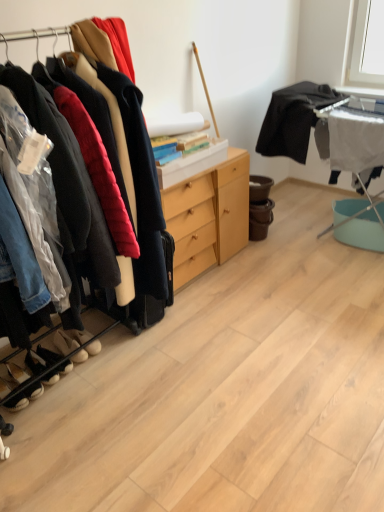
Question: Is black suede shoes at lower left, which appears as the second footwear when viewed from the front, shorter than white fabric ironing board at right?

Choices:
 (A) no
 (B) yes

Answer: (B)

Question: From a real-world perspective, is black suede shoes at lower left, which appears as the second footwear when viewed from the front, on top of white fabric ironing board at right?

Choices:
 (A) yes
 (B) no

Answer: (B)

Question: Considering the relative sizes of black suede shoes at lower left, which appears as the fourth footwear when viewed from the back, and white fabric ironing board at right in the image provided, is black suede shoes at lower left, which appears as the fourth footwear when viewed from the back, wider than white fabric ironing board at right?

Choices:
 (A) no
 (B) yes

Answer: (B)

Question: Can you confirm if black suede shoes at lower left, which appears as the second footwear when viewed from the front, is bigger than white fabric ironing board at right?

Choices:
 (A) yes
 (B) no

Answer: (B)

Question: From the image's perspective, is black suede shoes at lower left, which appears as the second footwear when viewed from the front, above white fabric ironing board at right?

Choices:
 (A) yes
 (B) no

Answer: (B)

Question: Based on their sizes in the image, would you say black matte shirt at upper right is bigger or smaller than black suede shoes at lower left, which appears as the fourth footwear when viewed from the back?

Choices:
 (A) big
 (B) small

Answer: (A)

Question: From a real-world perspective, relative to black suede shoes at lower left, which appears as the second footwear when viewed from the front, is black matte shirt at upper right vertically above or below?

Choices:
 (A) below
 (B) above

Answer: (B)

Question: From their relative heights in the image, would you say black matte shirt at upper right is taller or shorter than black suede shoes at lower left, which appears as the fourth footwear when viewed from the back?

Choices:
 (A) short
 (B) tall

Answer: (B)

Question: From the image's perspective, is black matte shirt at upper right located above or below black suede shoes at lower left, which appears as the second footwear when viewed from the front?

Choices:
 (A) above
 (B) below

Answer: (A)

Question: In the image, is white suede shoes at lower left, the fifth footwear in the back-to-front sequence, positioned in front of or behind black suede shoes at lower left, which appears as the fourth footwear when viewed from the back?

Choices:
 (A) behind
 (B) front

Answer: (B)

Question: In terms of height, does white suede shoes at lower left, the 1th footwear viewed from the front, look taller or shorter compared to black suede shoes at lower left, which appears as the second footwear when viewed from the front?

Choices:
 (A) short
 (B) tall

Answer: (B)

Question: From a real-world perspective, is white suede shoes at lower left, the 1th footwear viewed from the front, physically located above or below black suede shoes at lower left, which appears as the second footwear when viewed from the front?

Choices:
 (A) above
 (B) below

Answer: (A)

Question: Do you think white suede shoes at lower left, the fifth footwear in the back-to-front sequence, is within black suede shoes at lower left, which appears as the fourth footwear when viewed from the back, or outside of it?

Choices:
 (A) outside
 (B) inside

Answer: (A)

Question: In terms of width, does suede beige shoes at lower left, placed as the 4th footwear when sorted from front to back, look wider or thinner when compared to white suede shoes at lower left, the fifth footwear in the back-to-front sequence?

Choices:
 (A) thin
 (B) wide

Answer: (A)

Question: Based on their sizes in the image, would you say suede beige shoes at lower left, the 2th footwear viewed from the back, is bigger or smaller than white suede shoes at lower left, the fifth footwear in the back-to-front sequence?

Choices:
 (A) big
 (B) small

Answer: (B)